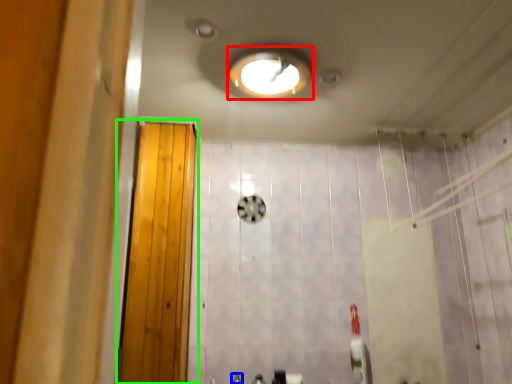
Question: Which object is positioned closest to light fixture (highlighted by a red box)? Select from faucet (highlighted by a blue box) and door (highlighted by a green box).

Choices:
 (A) faucet
 (B) door

Answer: (B)